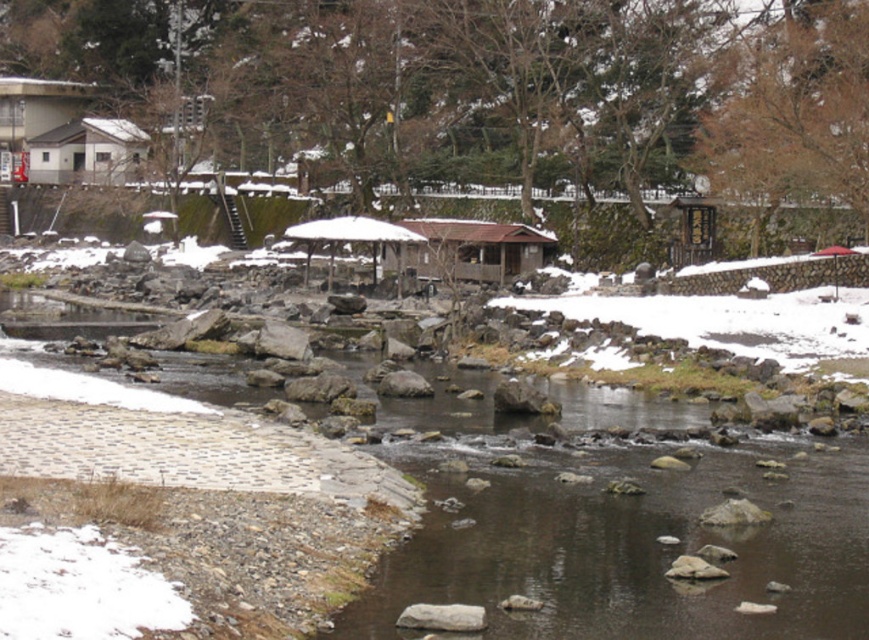
Does white matte hut at upper left appear under white matte umbrella at center?

No, white matte hut at upper left is not below white matte umbrella at center.

Which is behind, point (88, 144) or point (310, 244)?

The point (88, 144) is behind.

Where is `white matte hut at upper left`? The height and width of the screenshot is (640, 869). white matte hut at upper left is located at coordinates (87, 150).

This screenshot has width=869, height=640. What are the coordinates of `brown wooden hut at center` in the screenshot? It's located at (475, 250).

Image resolution: width=869 pixels, height=640 pixels. What do you see at coordinates (475, 250) in the screenshot? I see `brown wooden hut at center` at bounding box center [475, 250].

Does point (401, 257) come behind point (143, 131)?

No, (401, 257) is closer to viewer.

You are a GUI agent. You are given a task and a screenshot of the screen. Output one action in this format:
    pyautogui.click(x=<x>, y=<y>)
    Task: Click on the brown wooden hut at center
    
    Given the screenshot: What is the action you would take?
    pyautogui.click(x=475, y=250)

Looking at this image, is brown wooden hut at center shorter than white matte umbrella at center?

In fact, brown wooden hut at center may be taller than white matte umbrella at center.

Between brown wooden hut at center and white matte umbrella at center, which one is positioned lower?

brown wooden hut at center is lower down.

Does point (434, 260) lie behind point (308, 257)?

No, it is in front of (308, 257).

What are the coordinates of `brown wooden hut at center` in the screenshot? It's located at (475, 250).